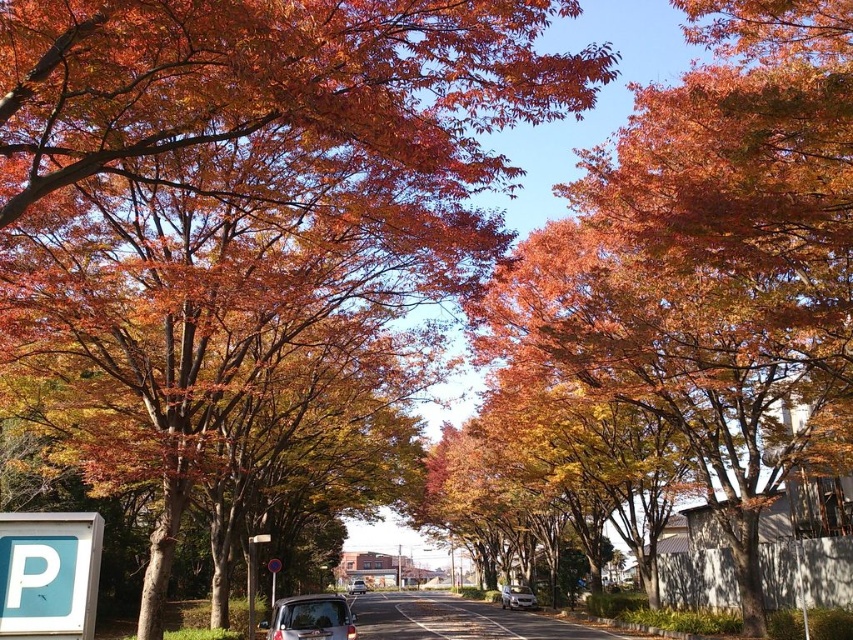
Who is positioned more to the left, metallic silver minivan at center or metallic reflective sign at center?

metallic reflective sign at center

Identify the location of metallic silver minivan at center. (311, 618).

Is metallic silver minivan at center closer to camera compared to metallic silver street sign at center?

Yes, metallic silver minivan at center is in front of metallic silver street sign at center.

Which is below, metallic silver minivan at center or metallic silver street sign at center?

metallic silver minivan at center is below.

The width and height of the screenshot is (853, 640). What do you see at coordinates (311, 618) in the screenshot?
I see `metallic silver minivan at center` at bounding box center [311, 618].

This screenshot has height=640, width=853. In order to click on metallic silver minivan at center in this screenshot , I will do `click(311, 618)`.

Does metallic silver car at center appear over metallic reflective sign at center?

No.

Looking at this image, between metallic silver car at center and metallic reflective sign at center, which one has less height?

With less height is metallic silver car at center.

Which is in front, point (505, 602) or point (274, 563)?

Point (274, 563)

Identify the location of metallic silver car at center. The height and width of the screenshot is (640, 853). (517, 596).